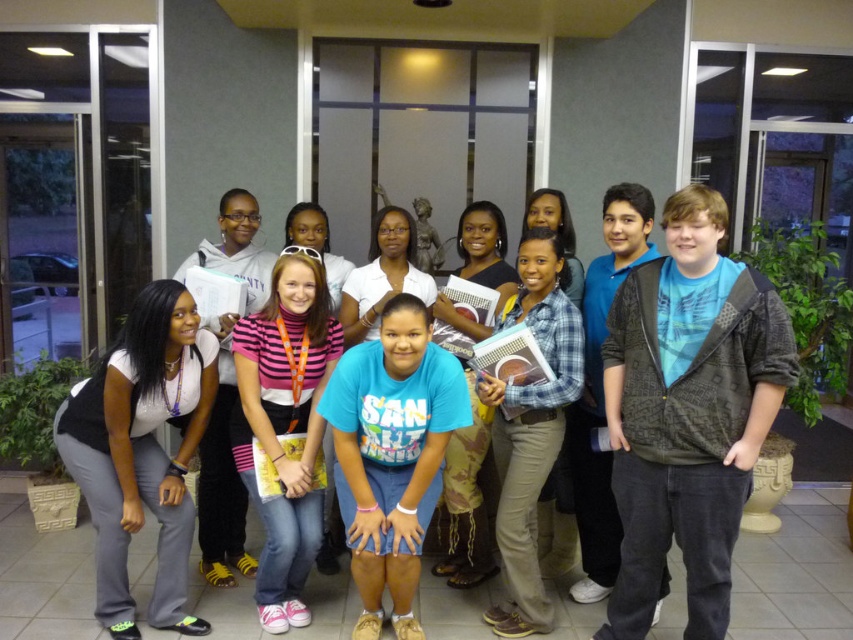
Which is more to the right, blue printed hoodie at center or pink striped turtleneck sweater at center?

Positioned to the right is blue printed hoodie at center.

Between point (653, 572) and point (277, 556), which one is positioned in front?

Positioned in front is point (653, 572).

Identify the location of blue printed hoodie at center. This screenshot has height=640, width=853. (688, 412).

Who is more distant from viewer, (656,280) or (351,428)?

The point (351,428) is more distant.

Is point (706, 388) farther from viewer compared to point (425, 308)?

No, (706, 388) is in front of (425, 308).

Image resolution: width=853 pixels, height=640 pixels. Find the location of `blue printed hoodie at center`. blue printed hoodie at center is located at coordinates (688, 412).

What do you see at coordinates (688, 412) in the screenshot? I see `blue printed hoodie at center` at bounding box center [688, 412].

Does blue printed hoodie at center have a smaller size compared to white matte pants at lower left?

No.

I want to click on blue printed hoodie at center, so click(x=688, y=412).